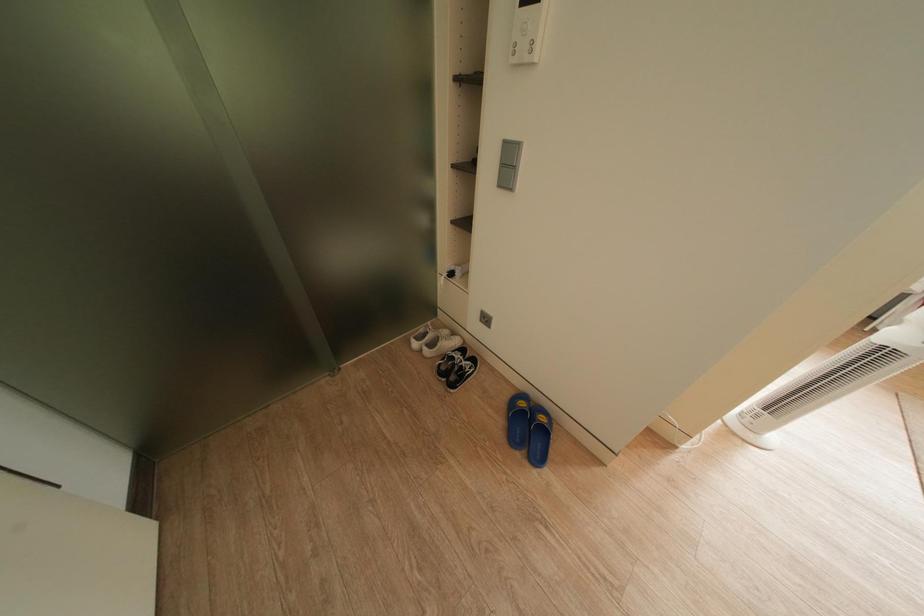
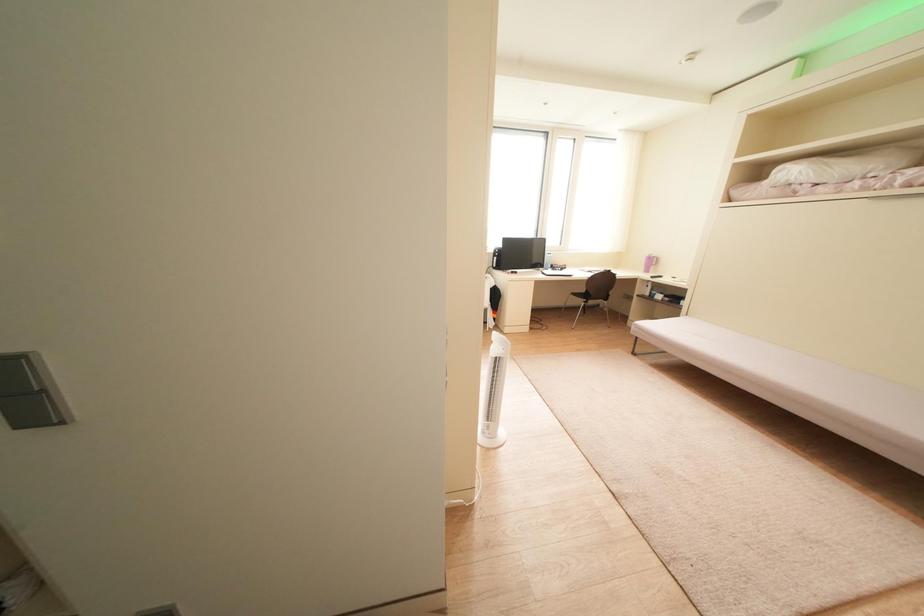
Question: The camera is either moving clockwise (left) or counter-clockwise (right) around the object. The first image is from the beginning of the video and the second image is from the end. Is the camera moving left or right when shooting the video?

Choices:
 (A) Left
 (B) Right

Answer: (A)